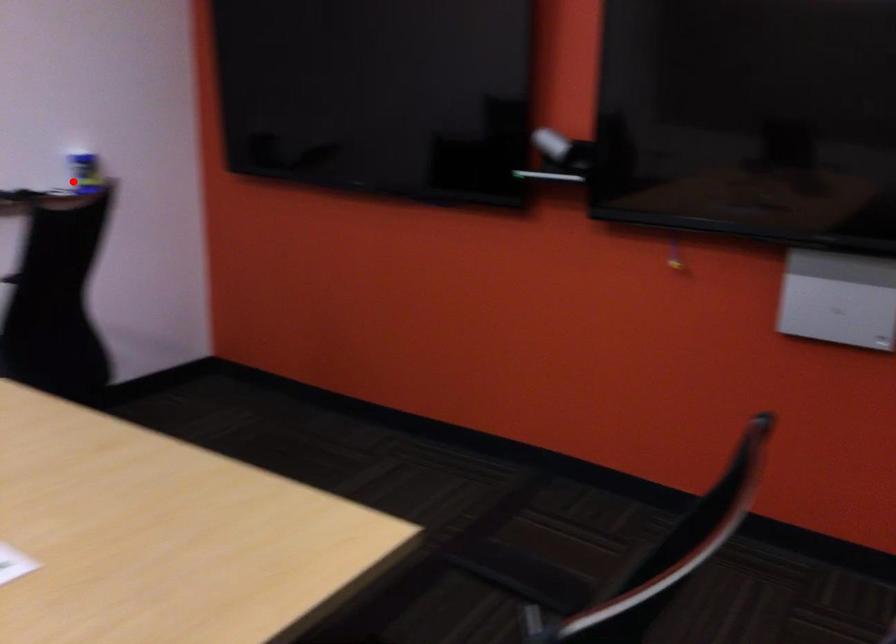
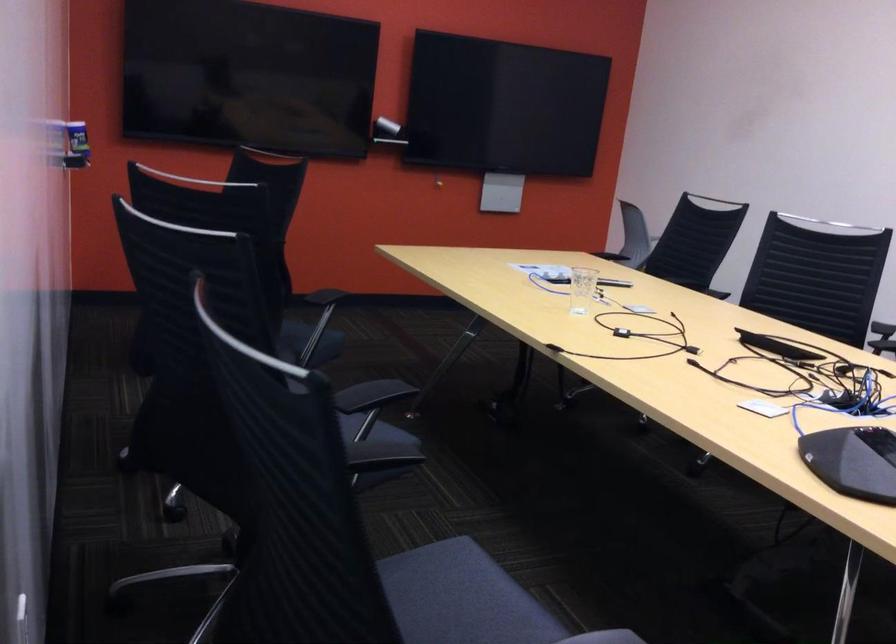
Find the pixel in the second image that matches the highlighted location in the first image.

(76, 145)